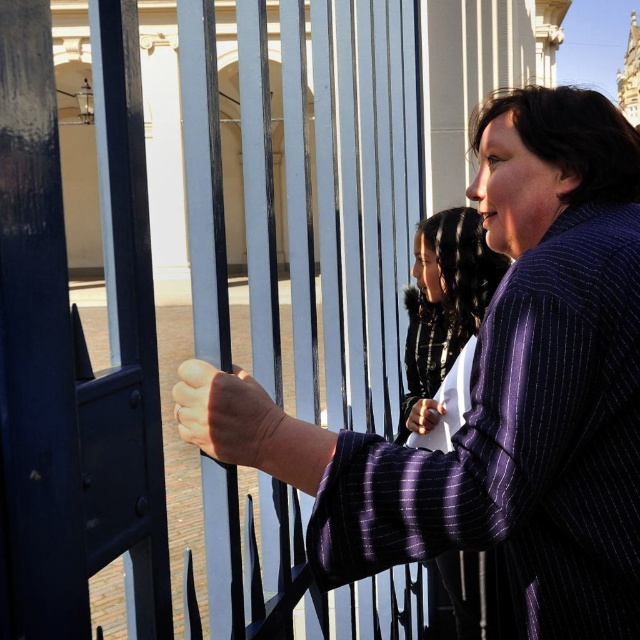
Is purple pinstripe robe at right thinner than pinstriped wool coat at center?

Incorrect, purple pinstripe robe at right's width is not less than pinstriped wool coat at center's.

How distant is purple pinstripe robe at right from pinstriped wool coat at center?

43.53 feet

Who is more distant from viewer, (580, 340) or (416, 349)?

The point (416, 349) is behind.

This screenshot has width=640, height=640. In order to click on purple pinstripe robe at right in this screenshot , I will do `click(522, 445)`.